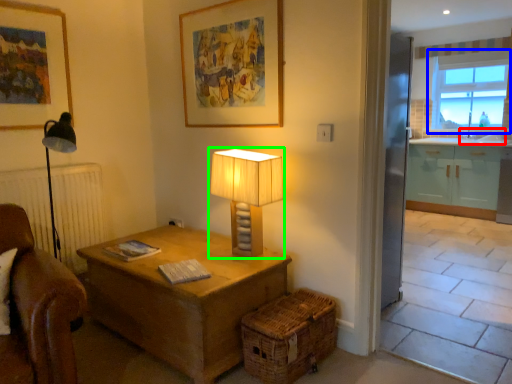
Question: Considering the real-world distances, which object is farthest from sink (highlighted by a red box)? window (highlighted by a blue box) or lamp (highlighted by a green box)?

Choices:
 (A) window
 (B) lamp

Answer: (B)